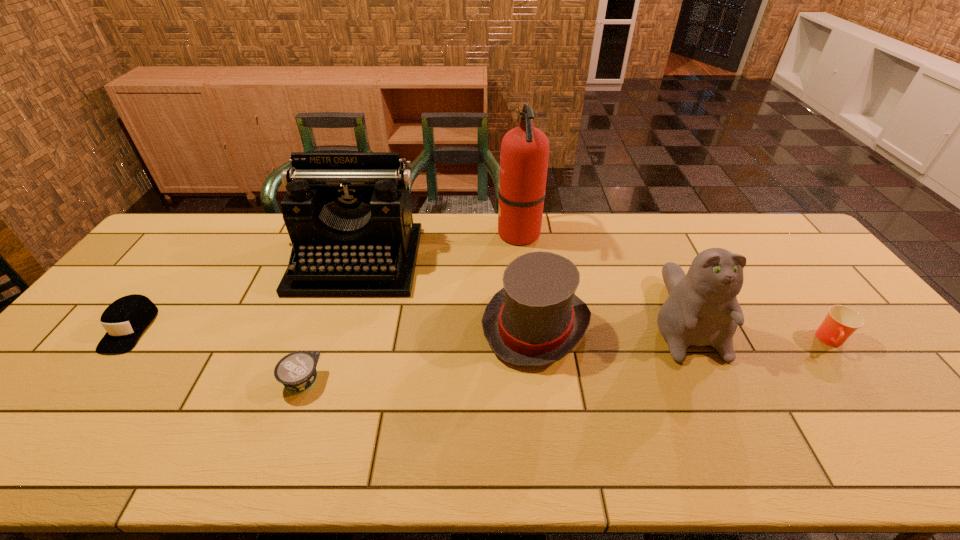
I want to click on the tallest object, so click(x=524, y=155).

Where is `typewriter`? typewriter is located at coordinates (348, 214).

Identify the location of the sixth object from left to right. The image size is (960, 540). (702, 309).

Find the location of a particular element. dress hat is located at coordinates (535, 319).

I want to click on cup, so click(x=841, y=322).

This screenshot has width=960, height=540. I want to click on the leftmost object, so click(125, 319).

Locate an element on the screen. The image size is (960, 540). the shortest object is located at coordinates (296, 371).

The height and width of the screenshot is (540, 960). In order to click on free spot located on the side of the fire extinguisher with the nozzle and handle in this screenshot , I will do `click(388, 233)`.

The height and width of the screenshot is (540, 960). I want to click on free space located on the side of the fire extinguisher with the nozzle and handle, so click(x=451, y=233).

Identify the location of blank space located 0.260m on the side of the fire extinguisher with the nozzle and handle. tap(422, 233).